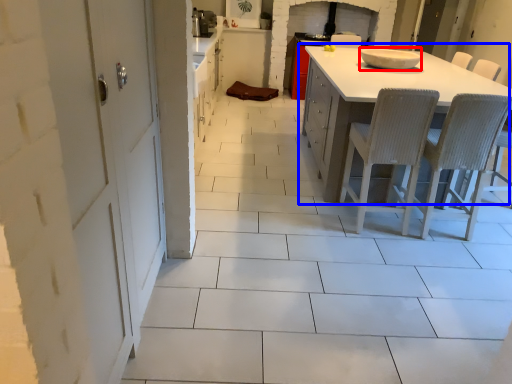
Question: Which of the following is the closest to the observer, appliance (highlighted by a red box) or table (highlighted by a blue box)?

Choices:
 (A) appliance
 (B) table

Answer: (B)